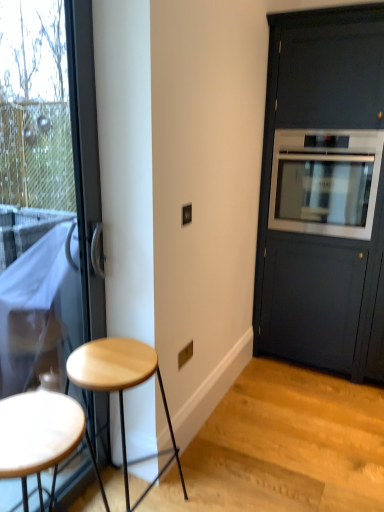
Describe the element at coordinates (40, 438) in the screenshot. I see `wooden stool at left, which appears as the second stool when viewed from the back` at that location.

What is the approximate height of satin silver oven at right?

23.46 inches.

Describe the element at coordinates (50, 216) in the screenshot. This screenshot has height=512, width=384. I see `transparent glass door at left` at that location.

This screenshot has height=512, width=384. I want to click on wooden stool at left, which appears as the second stool when viewed from the back, so click(x=40, y=438).

Is the depth of wooden stool at left, marked as the first stool in a front-to-back arrangement, greater than that of satin silver oven at right?

No, it is not.

Could you measure the distance between wooden stool at left, marked as the first stool in a front-to-back arrangement, and satin silver oven at right?

The distance of wooden stool at left, marked as the first stool in a front-to-back arrangement, from satin silver oven at right is 6.08 feet.

Between wooden stool at left, marked as the first stool in a front-to-back arrangement, and satin silver oven at right, which one has smaller width?

wooden stool at left, marked as the first stool in a front-to-back arrangement, is thinner.

Based on the photo, how many degrees apart are the facing directions of wooden stool at left, marked as the first stool in a front-to-back arrangement, and satin silver oven at right?

wooden stool at left, marked as the first stool in a front-to-back arrangement, and satin silver oven at right are facing 89.3 degrees away from each other.

From a real-world perspective, does wooden stool at left, which appears as the second stool when viewed from the back, stand above transparent glass door at left?

No, from a real-world perspective, wooden stool at left, which appears as the second stool when viewed from the back, is not above transparent glass door at left.

Could you tell me if wooden stool at left, which appears as the second stool when viewed from the back, is facing transparent glass door at left?

No.

Is point (24, 396) closer or farther from the camera than point (64, 324)?

Point (24, 396) is closer to the camera than point (64, 324).

Consider the image. From the image's perspective, is light wood stool at lower left, the second stool viewed from the front, over wooden stool at left, marked as the first stool in a front-to-back arrangement?

Indeed, from the image's perspective, light wood stool at lower left, the second stool viewed from the front, is shown above wooden stool at left, marked as the first stool in a front-to-back arrangement.

Measure the distance from light wood stool at lower left, the second stool viewed from the front, to wooden stool at left, which appears as the second stool when viewed from the back.

light wood stool at lower left, the second stool viewed from the front, and wooden stool at left, which appears as the second stool when viewed from the back, are 14.23 inches apart from each other.

From a real-world perspective, is light wood stool at lower left, the second stool viewed from the front, beneath wooden stool at left, marked as the first stool in a front-to-back arrangement?

Yes, from a real-world perspective, light wood stool at lower left, the second stool viewed from the front, is under wooden stool at left, marked as the first stool in a front-to-back arrangement.

Would you say wooden stool at left, which appears as the second stool when viewed from the back, is part of light wood stool at lower left, the second stool viewed from the front,'s contents?

No, wooden stool at left, which appears as the second stool when viewed from the back, is located outside of light wood stool at lower left, the second stool viewed from the front.

Is satin silver oven at right at the left side of wooden stool at left, marked as the first stool in a front-to-back arrangement?

No, satin silver oven at right is not to the left of wooden stool at left, marked as the first stool in a front-to-back arrangement.

From the image's perspective, is satin silver oven at right under wooden stool at left, which appears as the second stool when viewed from the back?

Incorrect, from the image's perspective, satin silver oven at right is higher than wooden stool at left, which appears as the second stool when viewed from the back.

Who is smaller, satin silver oven at right or wooden stool at left, marked as the first stool in a front-to-back arrangement?

Smaller between the two is wooden stool at left, marked as the first stool in a front-to-back arrangement.

From a real-world perspective, is transparent glass door at left on top of wooden stool at left, marked as the first stool in a front-to-back arrangement?

Yes, from a real-world perspective, transparent glass door at left is above wooden stool at left, marked as the first stool in a front-to-back arrangement.

Which object is positioned more to the left, transparent glass door at left or wooden stool at left, marked as the first stool in a front-to-back arrangement?

transparent glass door at left is more to the left.

Is transparent glass door at left located outside wooden stool at left, marked as the first stool in a front-to-back arrangement?

That's correct, transparent glass door at left is outside of wooden stool at left, marked as the first stool in a front-to-back arrangement.

How many degrees apart are the facing directions of transparent glass door at left and wooden stool at left, which appears as the second stool when viewed from the back?

1 degrees separate the facing orientations of transparent glass door at left and wooden stool at left, which appears as the second stool when viewed from the back.

Locate an element on the screen. door below the satin silver oven at right (from the image's perspective) is located at coordinates (50, 216).

Is transparent glass door at left facing towards satin silver oven at right?

No, transparent glass door at left is not aimed at satin silver oven at right.

Which object is wider, transparent glass door at left or satin silver oven at right?

With larger width is satin silver oven at right.

Which is correct: transparent glass door at left is inside satin silver oven at right, or outside of it?

transparent glass door at left exists outside the volume of satin silver oven at right.

Is wooden stool at left, marked as the first stool in a front-to-back arrangement, bigger than light wood stool at lower left, the first stool from the back?

Actually, wooden stool at left, marked as the first stool in a front-to-back arrangement, might be smaller than light wood stool at lower left, the first stool from the back.

Considering the relative positions of wooden stool at left, which appears as the second stool when viewed from the back, and light wood stool at lower left, the first stool from the back, in the image provided, is wooden stool at left, which appears as the second stool when viewed from the back, behind light wood stool at lower left, the first stool from the back,?

No, wooden stool at left, which appears as the second stool when viewed from the back, is closer to the camera.

From the image's perspective, which object appears higher, wooden stool at left, which appears as the second stool when viewed from the back, or light wood stool at lower left, the first stool from the back?

light wood stool at lower left, the first stool from the back.

Is point (23, 480) closer or farther from the camera than point (135, 507)?

Point (23, 480) is positioned farther from the camera compared to point (135, 507).

Locate an element on the screen. oven above the wooden stool at left, which appears as the second stool when viewed from the back (from the image's perspective) is located at coordinates (325, 181).

Where is `the 1st stool counting from the right of the transparent glass door at left`? This screenshot has width=384, height=512. the 1st stool counting from the right of the transparent glass door at left is located at coordinates (40, 438).

From the image, which object appears to be nearer to light wood stool at lower left, the first stool from the back, matte black cabinet at right or transparent glass door at left?

transparent glass door at left lies closer to light wood stool at lower left, the first stool from the back, than the other object.

Based on the photo, based on their spatial positions, is satin silver oven at right or transparent glass door at left closer to wooden stool at left, which appears as the second stool when viewed from the back?

Based on the image, transparent glass door at left appears to be nearer to wooden stool at left, which appears as the second stool when viewed from the back.

Based on their spatial positions, is light wood stool at lower left, the first stool from the back, or transparent glass door at left closer to matte black cabinet at right?

transparent glass door at left.

Considering their positions, is matte black cabinet at right positioned closer to light wood stool at lower left, the first stool from the back, than wooden stool at left, which appears as the second stool when viewed from the back?

Based on the image, wooden stool at left, which appears as the second stool when viewed from the back, appears to be nearer to light wood stool at lower left, the first stool from the back.

Based on their spatial positions, is light wood stool at lower left, the first stool from the back, or satin silver oven at right further from matte black cabinet at right?

Based on the image, light wood stool at lower left, the first stool from the back, appears to be further to matte black cabinet at right.

Looking at the image, which one is located further to satin silver oven at right, light wood stool at lower left, the first stool from the back, or matte black cabinet at right?

light wood stool at lower left, the first stool from the back, is further to satin silver oven at right.

Estimate the real-world distances between objects in this image. Which object is closer to light wood stool at lower left, the first stool from the back, satin silver oven at right or wooden stool at left, which appears as the second stool when viewed from the back?

wooden stool at left, which appears as the second stool when viewed from the back, is positioned closer to the anchor light wood stool at lower left, the first stool from the back.

Considering their positions, is satin silver oven at right positioned further to wooden stool at left, which appears as the second stool when viewed from the back, than light wood stool at lower left, the second stool viewed from the front?

Among the two, satin silver oven at right is located further to wooden stool at left, which appears as the second stool when viewed from the back.

The width and height of the screenshot is (384, 512). What are the coordinates of `oven situated between transparent glass door at left and matte black cabinet at right from left to right` in the screenshot? It's located at (325, 181).

The image size is (384, 512). Find the location of `stool between wooden stool at left, marked as the first stool in a front-to-back arrangement, and satin silver oven at right`. stool between wooden stool at left, marked as the first stool in a front-to-back arrangement, and satin silver oven at right is located at coordinates (120, 386).

Find the location of a particular element. Image resolution: width=384 pixels, height=512 pixels. stool located between wooden stool at left, which appears as the second stool when viewed from the back, and matte black cabinet at right in the left-right direction is located at coordinates (120, 386).

Find the location of a particular element. This screenshot has height=512, width=384. oven situated between light wood stool at lower left, the second stool viewed from the front, and matte black cabinet at right from left to right is located at coordinates (325, 181).